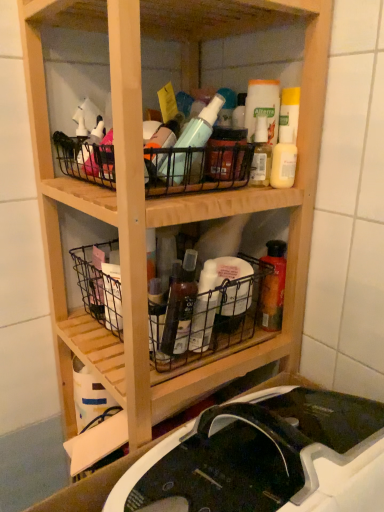
Image resolution: width=384 pixels, height=512 pixels. What do you see at coordinates (261, 154) in the screenshot?
I see `translucent plastic bottle at center, arranged as the 1th bottle when viewed from the right` at bounding box center [261, 154].

At what (x,y) coordinates should I click in order to perform the action: click on black wire basket at center, the 1th basket positioned from the bottom. Please return your answer as a coordinate pair (x, y). The width and height of the screenshot is (384, 512). Looking at the image, I should click on (209, 320).

Describe the element at coordinates (204, 308) in the screenshot. I see `translucent plastic bottle at center, which is the 1th bottle from left to right` at that location.

Measure the distance between metallic wire basket at lower left, placed as the 2th basket when sorted from bottom to top, and camera.

metallic wire basket at lower left, placed as the 2th basket when sorted from bottom to top, and camera are 78.05 centimeters apart from each other.

What do you see at coordinates (99, 285) in the screenshot? I see `metallic wire basket at lower left, marked as the second basket in a top-to-bottom arrangement` at bounding box center [99, 285].

Find the location of a particular element. The image size is (384, 512). matte white bottle at upper right is located at coordinates (286, 141).

Locate an element on the screen. Image resolution: width=384 pixels, height=512 pixels. black plastic sink at lower center is located at coordinates (265, 458).

Considering the sizes of objects metallic wire basket at lower left, marked as the second basket in a top-to-bottom arrangement, and black wire basket at upper center, acting as the third basket starting from the bottom, in the image provided, who is smaller, metallic wire basket at lower left, marked as the second basket in a top-to-bottom arrangement, or black wire basket at upper center, acting as the third basket starting from the bottom,?

metallic wire basket at lower left, marked as the second basket in a top-to-bottom arrangement.

Looking at this image, from the image's perspective, relative to black wire basket at upper center, acting as the third basket starting from the bottom, is metallic wire basket at lower left, placed as the 2th basket when sorted from bottom to top, above or below?

metallic wire basket at lower left, placed as the 2th basket when sorted from bottom to top, is situated lower than black wire basket at upper center, acting as the third basket starting from the bottom, in the image.

At what (x,y) coordinates should I click in order to perform the action: click on basket on the left of black wire basket at upper center, the first basket from the top. Please return your answer as a coordinate pair (x, y). Looking at the image, I should click on (99, 285).

Considering the positions of point (115, 326) and point (80, 178), is point (115, 326) closer or farther from the camera than point (80, 178)?

Point (115, 326) is farther from the camera than point (80, 178).

Are metallic wire basket at lower left, marked as the second basket in a top-to-bottom arrangement, and black plastic sink at lower center far apart?

No, metallic wire basket at lower left, marked as the second basket in a top-to-bottom arrangement, is not far from black plastic sink at lower center.

Between metallic wire basket at lower left, marked as the second basket in a top-to-bottom arrangement, and black plastic sink at lower center, which one has smaller width?

With smaller width is metallic wire basket at lower left, marked as the second basket in a top-to-bottom arrangement.

Does metallic wire basket at lower left, marked as the second basket in a top-to-bottom arrangement, lie in front of black plastic sink at lower center?

No, it is not.

Who is smaller, metallic wire basket at lower left, marked as the second basket in a top-to-bottom arrangement, or black plastic sink at lower center?

metallic wire basket at lower left, marked as the second basket in a top-to-bottom arrangement.

Is point (272, 176) closer or farther from the camera than point (105, 279)?

Point (272, 176) appears to be closer to the viewer than point (105, 279).

Looking at this image, can you confirm if matte white bottle at upper right is wider than metallic wire basket at lower left, marked as the second basket in a top-to-bottom arrangement?

No.

Is metallic wire basket at lower left, placed as the 2th basket when sorted from bottom to top, located within matte white bottle at upper right?

No.

Is black plastic sink at lower center far away from black wire basket at center, the 1th basket positioned from the bottom?

No, black plastic sink at lower center is not far away from black wire basket at center, the 1th basket positioned from the bottom.

From a real-world perspective, is black plastic sink at lower center physically below black wire basket at center, the 1th basket positioned from the bottom?

Yes, from a real-world perspective, black plastic sink at lower center is beneath black wire basket at center, the 1th basket positioned from the bottom.

In the scene shown: Can you confirm if black plastic sink at lower center is smaller than black wire basket at center, the 1th basket positioned from the bottom?

No, black plastic sink at lower center is not smaller than black wire basket at center, the 1th basket positioned from the bottom.

Identify the location of the 1st basket counting from the left side of the black plastic sink at lower center. (209, 320).

Between black wire basket at center, the 1th basket positioned from the bottom, and black plastic sink at lower center, which one has smaller width?

Thinner between the two is black wire basket at center, the 1th basket positioned from the bottom.

Between black wire basket at center, the third basket when ordered from top to bottom, and black plastic sink at lower center, which one has smaller size?

Smaller between the two is black wire basket at center, the third basket when ordered from top to bottom.

Considering the positions of objects black wire basket at center, the third basket when ordered from top to bottom, and black plastic sink at lower center in the image provided, who is in front, black wire basket at center, the third basket when ordered from top to bottom, or black plastic sink at lower center?

black plastic sink at lower center is in front.

Would you say black plastic sink at lower center is part of black wire basket at center, the 1th basket positioned from the bottom,'s contents?

Actually, black plastic sink at lower center is outside black wire basket at center, the 1th basket positioned from the bottom.

Which object is positioned more to the left, translucent plastic bottle at center, acting as the second bottle starting from the bottom, or black plastic sink at lower center?

From the viewer's perspective, black plastic sink at lower center appears more on the left side.

Considering the relative sizes of translucent plastic bottle at center, which appears as the 2th bottle when viewed from the left, and black plastic sink at lower center in the image provided, is translucent plastic bottle at center, which appears as the 2th bottle when viewed from the left, thinner than black plastic sink at lower center?

Yes, translucent plastic bottle at center, which appears as the 2th bottle when viewed from the left, is thinner than black plastic sink at lower center.

In the image, there is a translucent plastic bottle at center, which appears as the 2th bottle when viewed from the left. Where is `sink below it (from the image's perspective)`? The height and width of the screenshot is (512, 384). sink below it (from the image's perspective) is located at coordinates (265, 458).

From the image's perspective, which one is positioned higher, translucent plastic bottle at center, the 1th bottle from the top, or black plastic sink at lower center?

From the image's view, translucent plastic bottle at center, the 1th bottle from the top, is above.

Do you think black plastic sink at lower center is within translucent plastic bottle at center, which appears as the 2th bottle when viewed from the right, or outside of it?

black plastic sink at lower center is not enclosed by translucent plastic bottle at center, which appears as the 2th bottle when viewed from the right.

Does black plastic sink at lower center have a smaller size compared to translucent plastic bottle at center, placed as the first bottle when sorted from bottom to top?

No.

Is there a large distance between black plastic sink at lower center and translucent plastic bottle at center, which is the 1th bottle from left to right?

That's not correct — black plastic sink at lower center is a little close to translucent plastic bottle at center, which is the 1th bottle from left to right.

Considering the relative sizes of black plastic sink at lower center and translucent plastic bottle at center, which is the 1th bottle from left to right, in the image provided, is black plastic sink at lower center thinner than translucent plastic bottle at center, which is the 1th bottle from left to right,?

In fact, black plastic sink at lower center might be wider than translucent plastic bottle at center, which is the 1th bottle from left to right.

This screenshot has width=384, height=512. Find the location of `basket positioned vertically above the metallic wire basket at lower left, marked as the second basket in a top-to-bottom arrangement (from a real-world perspective)`. basket positioned vertically above the metallic wire basket at lower left, marked as the second basket in a top-to-bottom arrangement (from a real-world perspective) is located at coordinates (197, 169).

Where is `the 3rd basket to the left of the black plastic sink at lower center, counting from the anchor's position`? The height and width of the screenshot is (512, 384). the 3rd basket to the left of the black plastic sink at lower center, counting from the anchor's position is located at coordinates (99, 285).

When comparing their distances from matte white bottle at upper right, does black wire basket at upper center, acting as the third basket starting from the bottom, or translucent plastic bottle at center, which appears as the 2th bottle when viewed from the right, seem closer?

Based on the image, black wire basket at upper center, acting as the third basket starting from the bottom, appears to be nearer to matte white bottle at upper right.

Considering their positions, is black wire basket at center, the third basket when ordered from top to bottom, positioned further to matte white bottle at upper right than metallic wire basket at lower left, placed as the 2th basket when sorted from bottom to top?

metallic wire basket at lower left, placed as the 2th basket when sorted from bottom to top.

From the image, which object appears to be farther from matte white bottle at upper right, metallic wire basket at lower left, marked as the second basket in a top-to-bottom arrangement, or black plastic sink at lower center?

black plastic sink at lower center.

Estimate the real-world distances between objects in this image. Which object is further from metallic wire basket at lower left, marked as the second basket in a top-to-bottom arrangement, matte white bottle at upper right or black wire basket at center, the 1th basket positioned from the bottom?

Based on the image, matte white bottle at upper right appears to be further to metallic wire basket at lower left, marked as the second basket in a top-to-bottom arrangement.

Considering their positions, is translucent plastic bottle at center, placed as the first bottle when sorted from bottom to top, positioned closer to black wire basket at upper center, acting as the third basket starting from the bottom, than black plastic sink at lower center?

The object closer to black wire basket at upper center, acting as the third basket starting from the bottom, is translucent plastic bottle at center, placed as the first bottle when sorted from bottom to top.

Which object lies further to the anchor point translucent plastic bottle at center, which appears as the 2th bottle when viewed from the left, translucent plastic bottle at center, placed as the first bottle when sorted from bottom to top, or matte white bottle at upper right?

translucent plastic bottle at center, placed as the first bottle when sorted from bottom to top, is positioned further to the anchor translucent plastic bottle at center, which appears as the 2th bottle when viewed from the left.

Estimate the real-world distances between objects in this image. Which object is further from translucent plastic bottle at center, the second bottle positioned from the top, translucent plastic bottle at center, which appears as the 2th bottle when viewed from the left, or matte white bottle at upper right?

matte white bottle at upper right lies further to translucent plastic bottle at center, the second bottle positioned from the top, than the other object.

Which object lies further to the anchor point black plastic sink at lower center, translucent plastic bottle at center, which is the 1th bottle from left to right, or black wire basket at center, the third basket when ordered from top to bottom?

Among the two, translucent plastic bottle at center, which is the 1th bottle from left to right, is located further to black plastic sink at lower center.

Find the location of a particular element. basket that lies between black wire basket at upper center, the first basket from the top, and black wire basket at center, the 1th basket positioned from the bottom, from top to bottom is located at coordinates (99, 285).

Find the location of `basket between translucent plastic bottle at center, which is the 1th bottle from left to right, and black plastic sink at lower center vertically`. basket between translucent plastic bottle at center, which is the 1th bottle from left to right, and black plastic sink at lower center vertically is located at coordinates pos(209,320).

You are a GUI agent. You are given a task and a screenshot of the screen. Output one action in this format:
    pyautogui.click(x=<x>, y=<y>)
    Task: Click on the bottle between matte white bottle at upper right and translucent plastic bottle at center, placed as the first bottle when sorted from bottom to top, in the up-down direction
    Image resolution: width=384 pixels, height=512 pixels.
    Given the screenshot: What is the action you would take?
    pyautogui.click(x=261, y=154)

This screenshot has height=512, width=384. What are the coordinates of `bottle located between metallic wire basket at lower left, marked as the second basket in a top-to-bottom arrangement, and translucent plastic bottle at center, the 1th bottle from the top, in the left-right direction` in the screenshot? It's located at (204, 308).